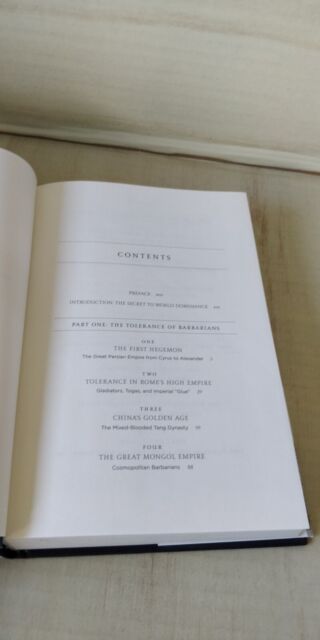
At what (x,y) coordinates should I click in order to perform the action: click on table. Please return your answer as a coordinate pair (x, y). Looking at the image, I should click on (188, 609).